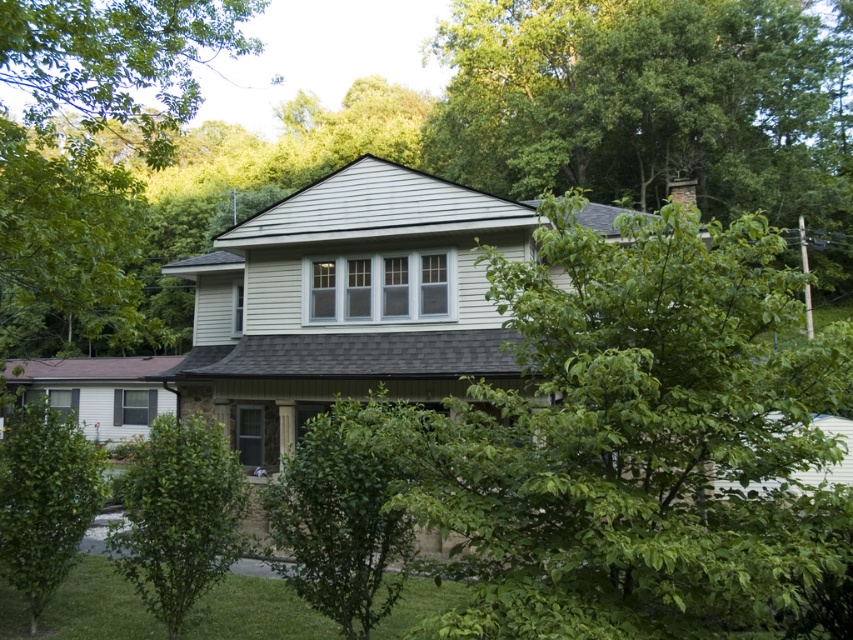
Question: Which point is closer to the camera taking this photo?

Choices:
 (A) (779, 243)
 (B) (320, 461)

Answer: (A)

Question: Observing the image, what is the correct spatial positioning of green leafy tree at center in reference to green leafy hedge at center?

Choices:
 (A) above
 (B) below

Answer: (A)

Question: Which of the following is the closest to the observer?

Choices:
 (A) (813, 364)
 (B) (347, 579)

Answer: (A)

Question: Observing the image, what is the correct spatial positioning of green leafy hedge at center in reference to green leafy bush at lower left?

Choices:
 (A) below
 (B) above

Answer: (B)

Question: Which object is closer to the camera taking this photo?

Choices:
 (A) green leafy hedge at center
 (B) green leafy bush at lower left

Answer: (A)

Question: Is the position of green leafy hedge at center more distant than that of green leafy bush at lower left?

Choices:
 (A) no
 (B) yes

Answer: (A)